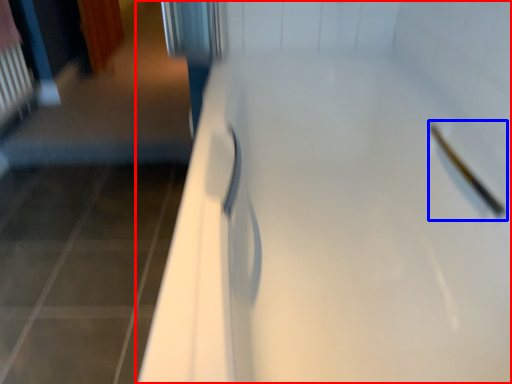
Question: Which point is further to the camera, door (highlighted by a red box) or shower (highlighted by a blue box)?

Choices:
 (A) door
 (B) shower

Answer: (B)